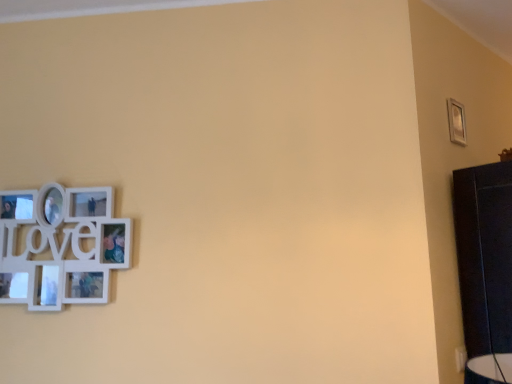
Question: From the image's perspective, is white matte picture frame at left, arranged as the 1th picture frame when viewed from the front, over silver metallic picture frame at upper right, the 1th picture frame viewed from the top?

Choices:
 (A) yes
 (B) no

Answer: (B)

Question: Is white matte picture frame at left, arranged as the 1th picture frame when ordered from the bottom, smaller than silver metallic picture frame at upper right, the second picture frame positioned from the front?

Choices:
 (A) yes
 (B) no

Answer: (B)

Question: Could you tell me if white matte picture frame at left, positioned as the first picture frame in left-to-right order, is facing silver metallic picture frame at upper right, the 1th picture frame viewed from the top?

Choices:
 (A) yes
 (B) no

Answer: (B)

Question: Can we say white matte picture frame at left, positioned as the first picture frame in left-to-right order, lies outside silver metallic picture frame at upper right, the second picture frame positioned from the left?

Choices:
 (A) yes
 (B) no

Answer: (A)

Question: Does white matte picture frame at left, the second picture frame from the top, have a larger size compared to silver metallic picture frame at upper right, the second picture frame when ordered from bottom to top?

Choices:
 (A) no
 (B) yes

Answer: (B)

Question: Is white matte picture frame at left, arranged as the 1th picture frame when ordered from the bottom, closer to the viewer compared to silver metallic picture frame at upper right, the 1th picture frame viewed from the top?

Choices:
 (A) yes
 (B) no

Answer: (A)

Question: From the image's perspective, is silver metallic picture frame at upper right, the second picture frame positioned from the left, above white matte picture frame at left, positioned as the first picture frame in left-to-right order?

Choices:
 (A) no
 (B) yes

Answer: (B)

Question: From a real-world perspective, is silver metallic picture frame at upper right, the second picture frame positioned from the left, positioned under white matte picture frame at left, arranged as the second picture frame when viewed from the back, based on gravity?

Choices:
 (A) yes
 (B) no

Answer: (B)

Question: Is silver metallic picture frame at upper right, the 1th picture frame in the back-to-front sequence, bigger than white matte picture frame at left, positioned as the first picture frame in left-to-right order?

Choices:
 (A) yes
 (B) no

Answer: (B)

Question: Is silver metallic picture frame at upper right, the second picture frame when ordered from bottom to top, at the right side of white matte picture frame at left, arranged as the 1th picture frame when viewed from the front?

Choices:
 (A) no
 (B) yes

Answer: (B)

Question: Considering the relative sizes of silver metallic picture frame at upper right, the second picture frame positioned from the front, and white matte picture frame at left, positioned as the first picture frame in left-to-right order, in the image provided, is silver metallic picture frame at upper right, the second picture frame positioned from the front, wider than white matte picture frame at left, positioned as the first picture frame in left-to-right order,?

Choices:
 (A) no
 (B) yes

Answer: (A)

Question: Is silver metallic picture frame at upper right, the second picture frame when ordered from bottom to top, shorter than white matte picture frame at left, the second picture frame from the top?

Choices:
 (A) no
 (B) yes

Answer: (B)

Question: Considering the positions of silver metallic picture frame at upper right, the 1th picture frame viewed from the top, and white matte picture frame at left, the second picture frame from the top, in the image, is silver metallic picture frame at upper right, the 1th picture frame viewed from the top, taller or shorter than white matte picture frame at left, the second picture frame from the top,?

Choices:
 (A) tall
 (B) short

Answer: (B)